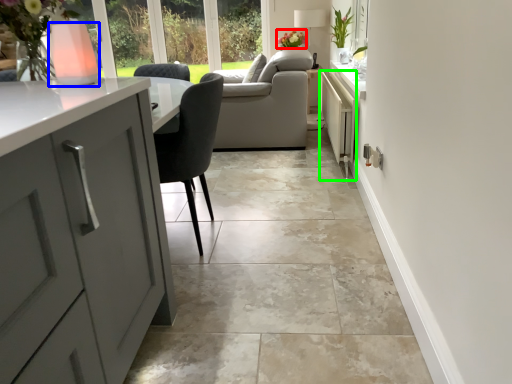
Question: Which object is the farthest from flower (highlighted by a red box)? Choose among these: vase (highlighted by a blue box) or appliance (highlighted by a green box).

Choices:
 (A) vase
 (B) appliance

Answer: (A)